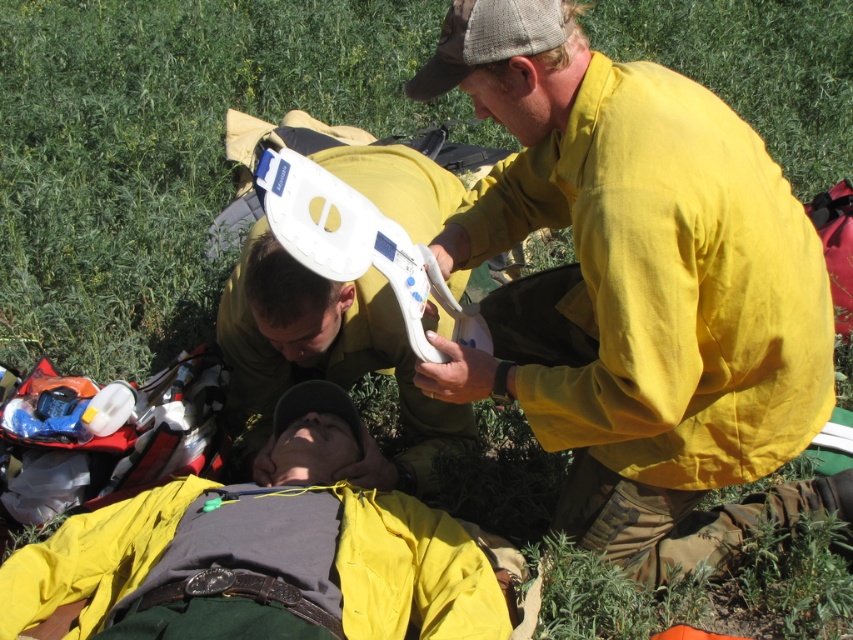
Question: Which point is farther to the camera?

Choices:
 (A) yellow fabric shirt at upper right
 (B) yellow fabric at center

Answer: (B)

Question: Can you confirm if yellow fabric at center is positioned above white plastic device at center?

Choices:
 (A) no
 (B) yes

Answer: (A)

Question: Which point is farther from the camera taking this photo?

Choices:
 (A) (415, 314)
 (B) (741, 337)
 (C) (432, 515)

Answer: (C)

Question: Does yellow fabric shirt at upper right appear on the left side of white plastic device at center?

Choices:
 (A) yes
 (B) no

Answer: (B)

Question: Is yellow fabric shirt at upper right further to the viewer compared to white plastic device at center?

Choices:
 (A) yes
 (B) no

Answer: (B)

Question: Which point is closer to the camera?

Choices:
 (A) yellow fabric shirt at upper right
 (B) yellow fabric at center

Answer: (A)